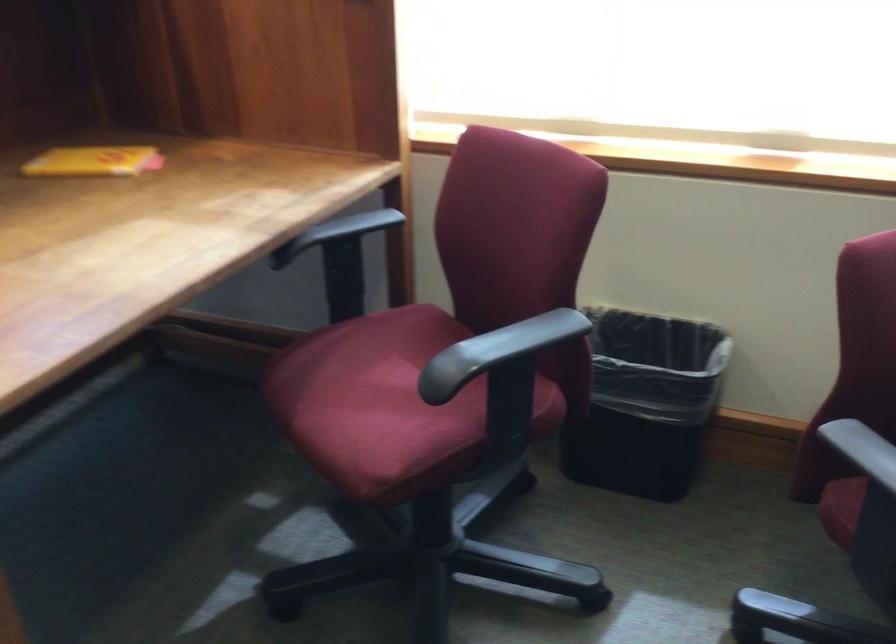
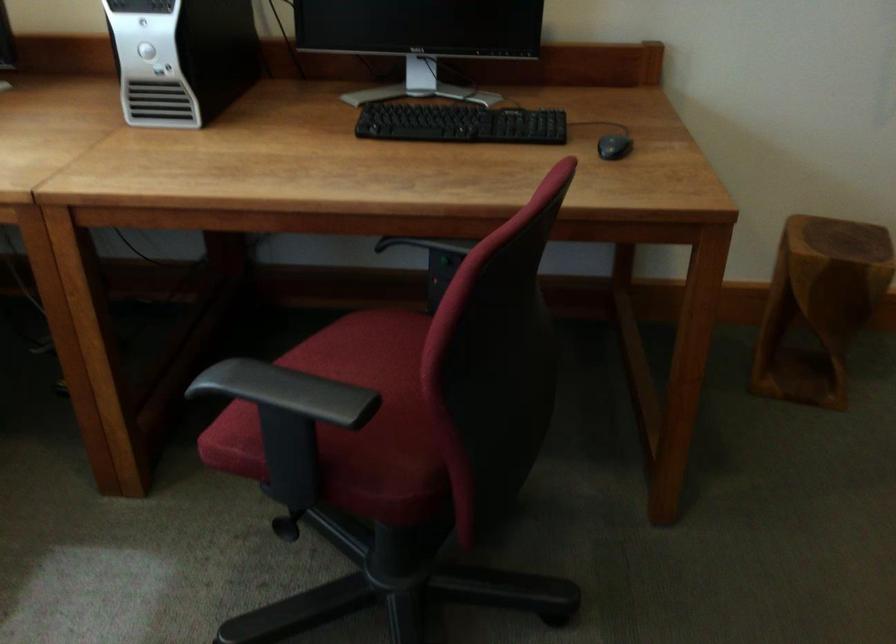
First-person continuous shooting, in which direction is the camera rotating?

The camera rotated toward right-down.